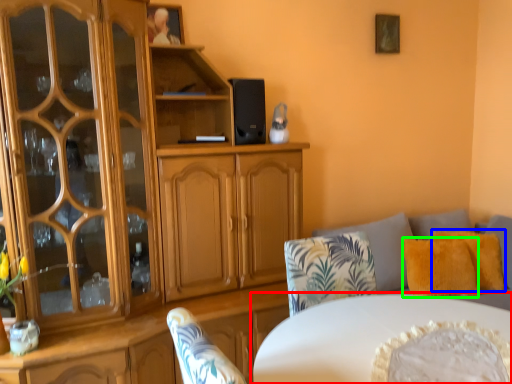
Question: Considering the real-world distances, which object is farthest from table (highlighted by a red box)? pillow (highlighted by a blue box) or pillow (highlighted by a green box)?

Choices:
 (A) pillow
 (B) pillow

Answer: (A)